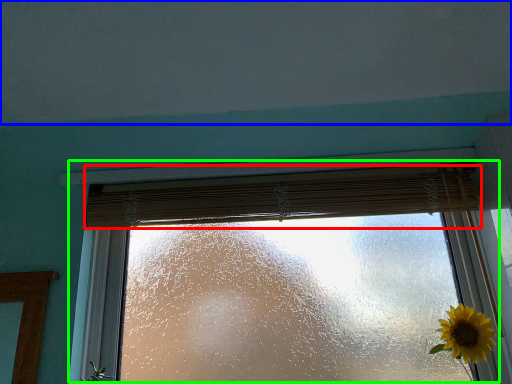
Question: Which is farther away from curtain (highlighted by a red box)? backdrop (highlighted by a blue box) or window (highlighted by a green box)?

Choices:
 (A) backdrop
 (B) window

Answer: (A)